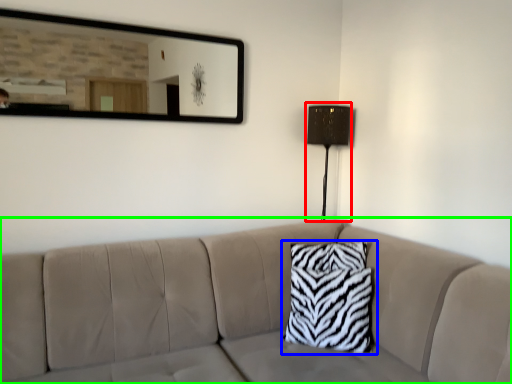
Question: Which object is positioned closest to table lamp (highlighted by a red box)? Select from pillow (highlighted by a blue box) and studio couch (highlighted by a green box).

Choices:
 (A) pillow
 (B) studio couch

Answer: (A)